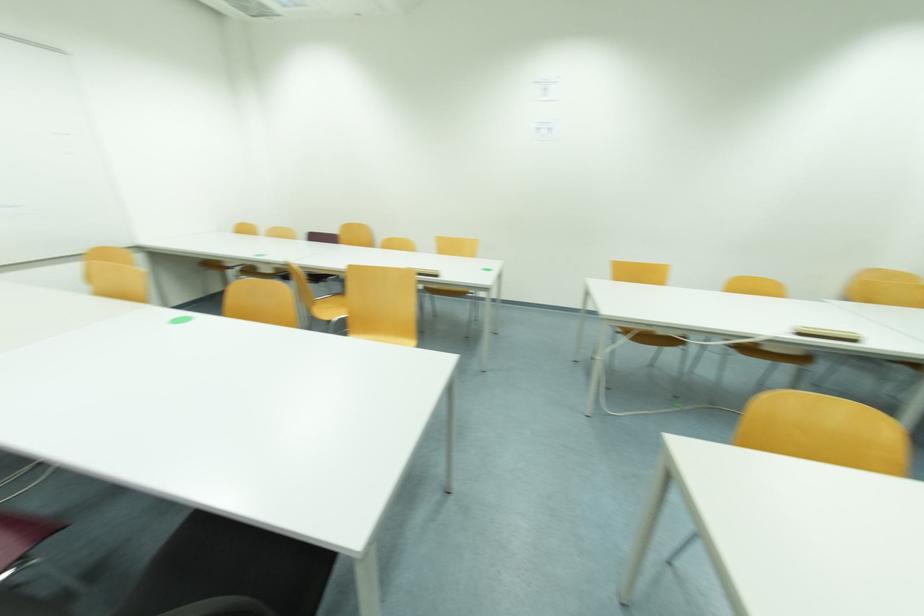
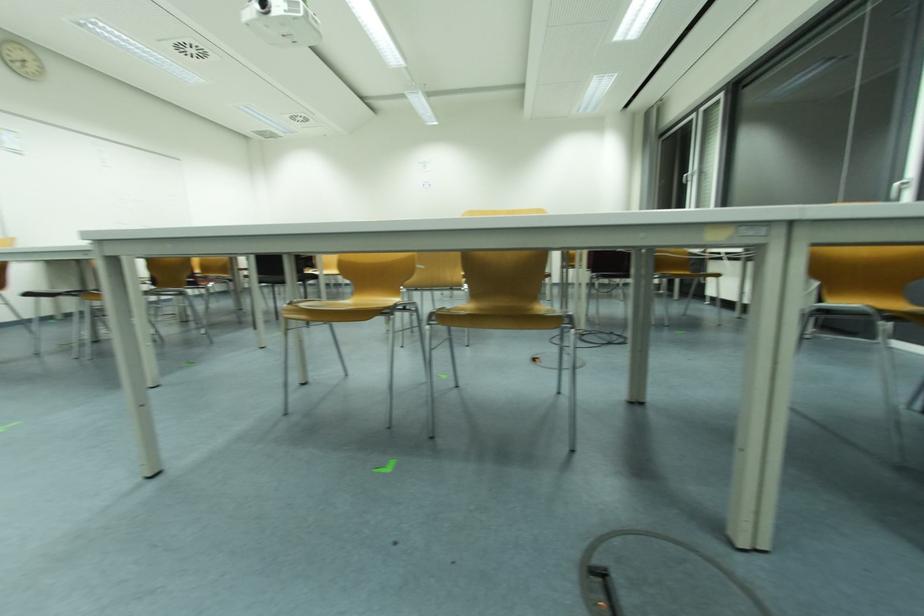
Question: Which direction would the cameraman need to move to produce the second image? Reply with the corresponding letter.

Choices:
 (A) Left
 (B) Right
 (C) Forward
 (D) Backward

Answer: (D)